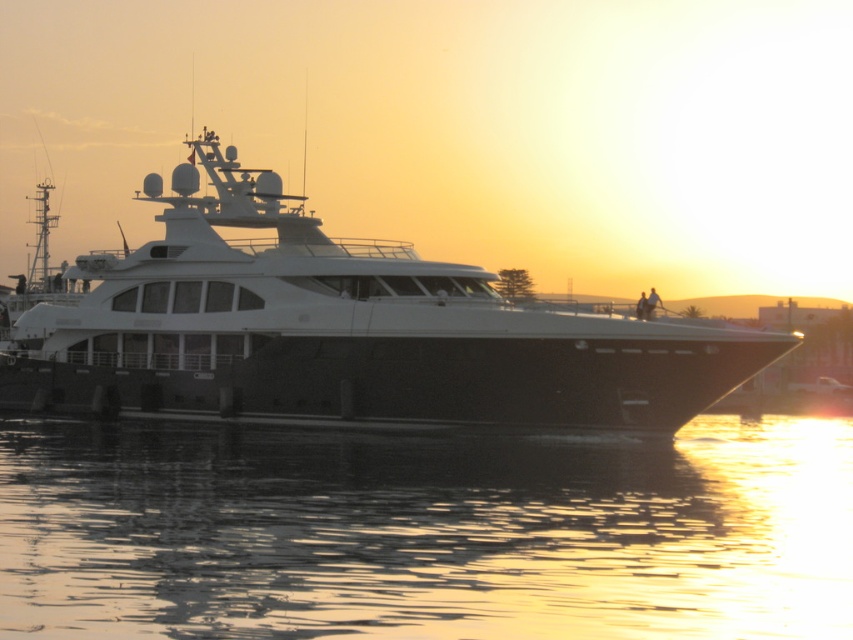
Question: Which object is closer to the camera taking this photo?

Choices:
 (A) white glossy yacht at center
 (B) glistening water at lower center

Answer: (B)

Question: Is glistening water at lower center below white glossy yacht at center?

Choices:
 (A) yes
 (B) no

Answer: (A)

Question: Among these objects, which one is farthest from the camera?

Choices:
 (A) white glossy yacht at center
 (B) glistening water at lower center

Answer: (A)

Question: Which point is farther to the camera?

Choices:
 (A) glistening water at lower center
 (B) white glossy yacht at center

Answer: (B)

Question: Is glistening water at lower center below white glossy yacht at center?

Choices:
 (A) yes
 (B) no

Answer: (A)

Question: Does glistening water at lower center have a smaller size compared to white glossy yacht at center?

Choices:
 (A) no
 (B) yes

Answer: (B)